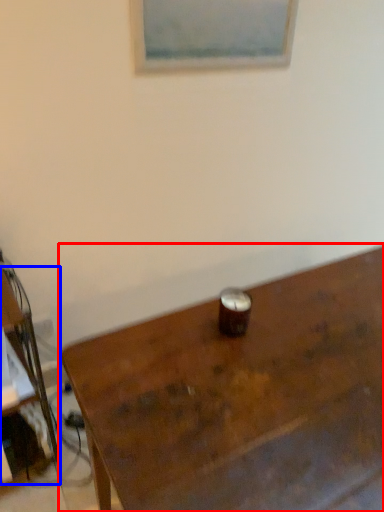
Question: Which object appears farthest to the camera in this image, table (highlighted by a red box) or desk (highlighted by a blue box)?

Choices:
 (A) table
 (B) desk

Answer: (B)